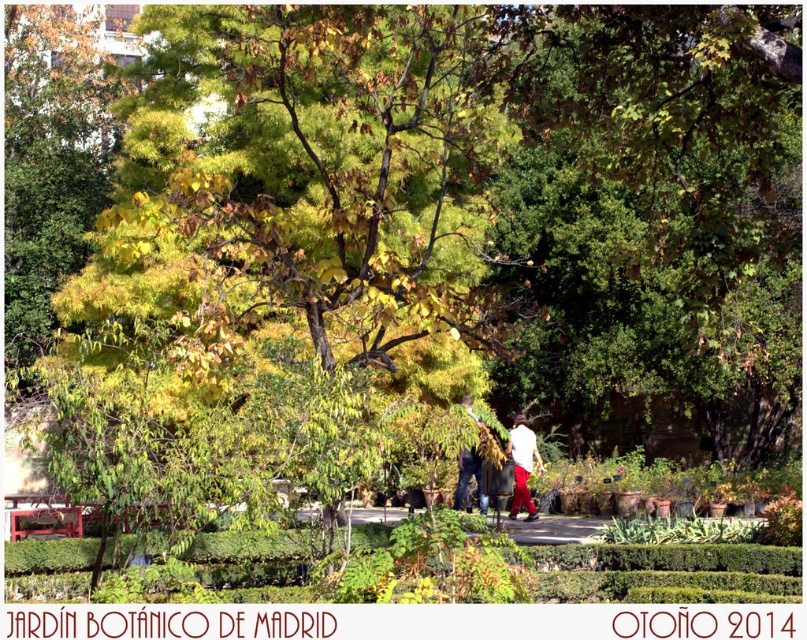
Between white cotton shirt at center and white matte shirt at center, which one is positioned lower?

white matte shirt at center

This screenshot has height=640, width=807. Describe the element at coordinates (521, 461) in the screenshot. I see `white cotton shirt at center` at that location.

Where is `white cotton shirt at center`? This screenshot has height=640, width=807. white cotton shirt at center is located at coordinates (521, 461).

Is green leafy tree at center to the left of white matte shirt at center from the viewer's perspective?

No, green leafy tree at center is not to the left of white matte shirt at center.

Can you confirm if green leafy tree at center is taller than white matte shirt at center?

Indeed, green leafy tree at center has a greater height compared to white matte shirt at center.

The width and height of the screenshot is (807, 640). What are the coordinates of `green leafy tree at center` in the screenshot? It's located at 657,209.

Identify the location of white matte shirt at center. (521, 465).

Is white matte shirt at center below dark blue jeans at center?

Correct, white matte shirt at center is located below dark blue jeans at center.

Does point (513, 504) lie in front of point (484, 500)?

No.

At what (x,y) coordinates should I click in order to perform the action: click on white matte shirt at center. Please return your answer as a coordinate pair (x, y). The image size is (807, 640). Looking at the image, I should click on (521, 465).